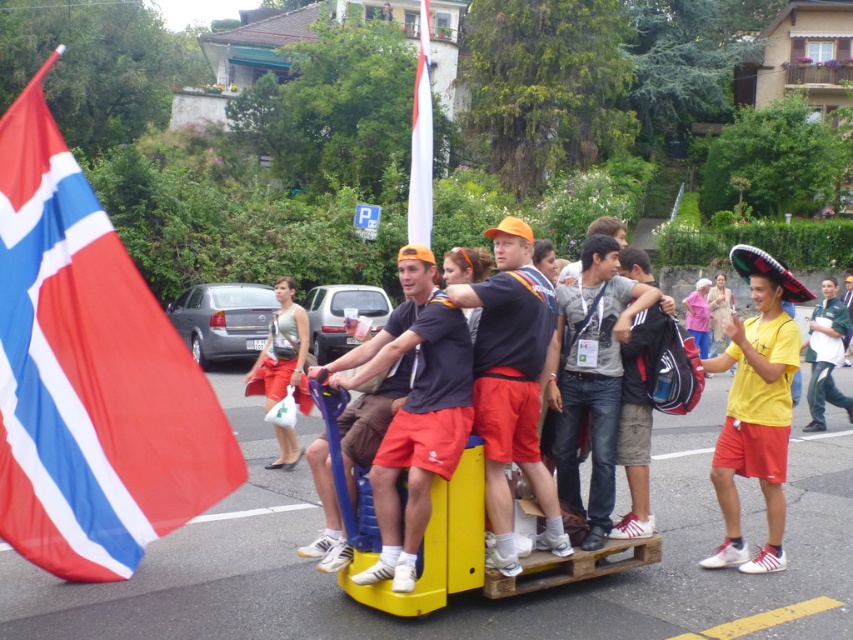
Can you confirm if matte black shirt at center is smaller than green uniform at center?

No.

Is matte black shirt at center thinner than green uniform at center?

In fact, matte black shirt at center might be wider than green uniform at center.

Is point (346, 385) in front of point (811, 408)?

That is True.

At what (x,y) coordinates should I click in order to perform the action: click on matte black shirt at center. Please return your answer as a coordinate pair (x, y). The height and width of the screenshot is (640, 853). Looking at the image, I should click on (415, 412).

Does denim jeans at center have a greater height compared to green uniform at center?

Indeed, denim jeans at center has a greater height compared to green uniform at center.

Does denim jeans at center have a smaller size compared to green uniform at center?

No, denim jeans at center is not smaller than green uniform at center.

Does point (598, 333) come closer to viewer compared to point (827, 380)?

Yes, point (598, 333) is closer to viewer.

Where is `denim jeans at center`? Image resolution: width=853 pixels, height=640 pixels. denim jeans at center is located at coordinates (592, 376).

Who is more forward, [834,394] or [416,134]?

Point [416,134] is in front.

Locate an element on the screen. This screenshot has width=853, height=640. green uniform at center is located at coordinates (825, 355).

Which is in front, point (830, 376) or point (415, 122)?

Point (415, 122) is more forward.

Where is `green uniform at center`? Image resolution: width=853 pixels, height=640 pixels. green uniform at center is located at coordinates (825, 355).